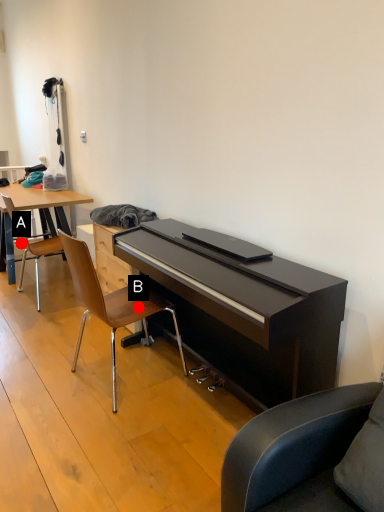
Question: Two points are circled on the image, labeled by A and B beside each circle. Which point is closer to the camera?

Choices:
 (A) A is closer
 (B) B is closer

Answer: (B)